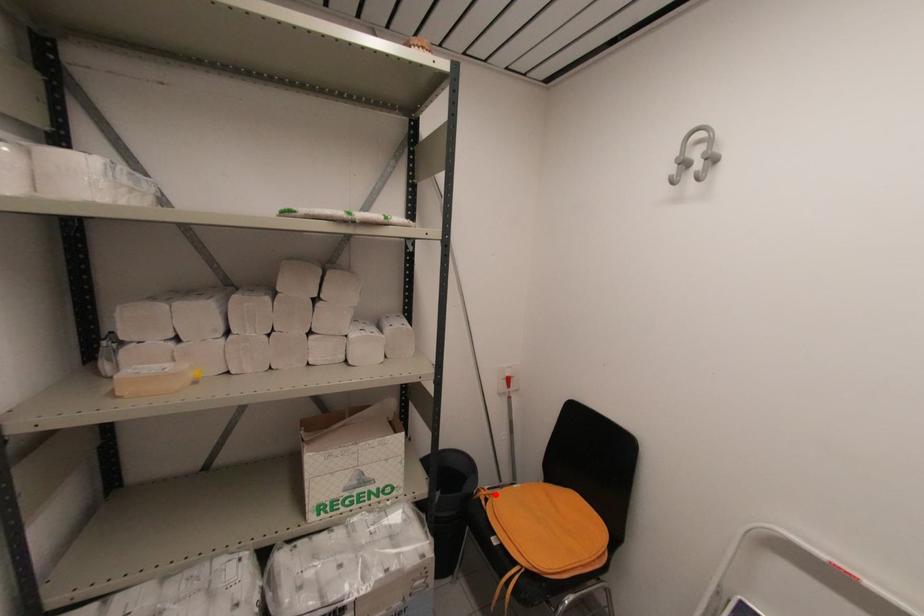
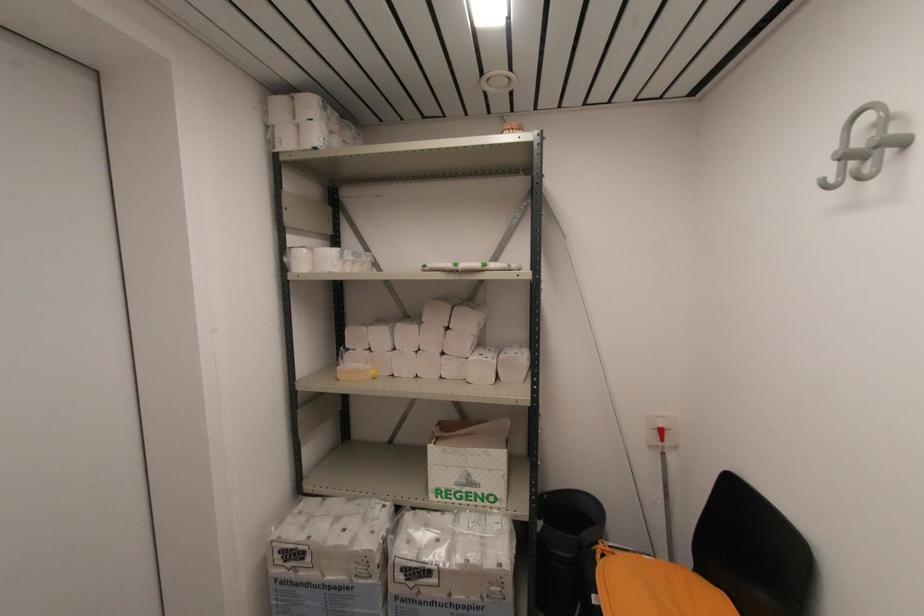
In the second image, find the point that corresponds to the highlighted location in the first image.

(614, 554)